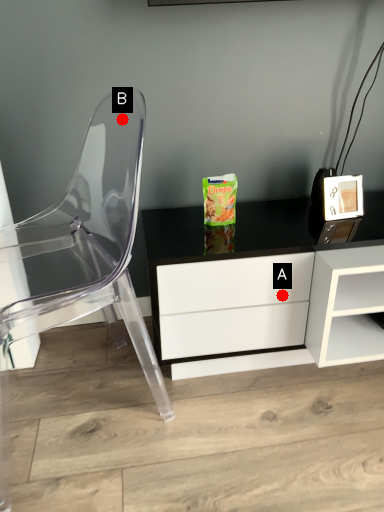
Question: Two points are circled on the image, labeled by A and B beside each circle. Which point is closer to the camera?

Choices:
 (A) A is closer
 (B) B is closer

Answer: (A)